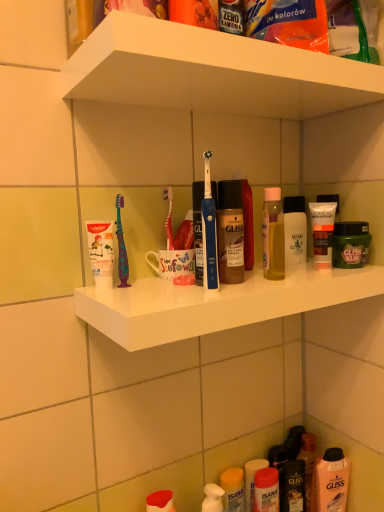
Question: Is white plastic shelf at upper center, which is the first supermarket shelf from top to bottom, shorter than white plastic shelf at upper center, the 1th supermarket shelf positioned from the bottom?

Choices:
 (A) yes
 (B) no

Answer: (A)

Question: Is white plastic shelf at upper center, acting as the 2th supermarket shelf starting from the bottom, positioned with its back to white plastic shelf at upper center, the 1th supermarket shelf positioned from the bottom?

Choices:
 (A) yes
 (B) no

Answer: (B)

Question: Are white plastic shelf at upper center, which is the first supermarket shelf from top to bottom, and white plastic shelf at upper center, positioned as the 2th supermarket shelf in top-to-bottom order, far apart?

Choices:
 (A) yes
 (B) no

Answer: (B)

Question: Can we say white plastic shelf at upper center, acting as the 2th supermarket shelf starting from the bottom, lies outside white plastic shelf at upper center, positioned as the 2th supermarket shelf in top-to-bottom order?

Choices:
 (A) no
 (B) yes

Answer: (B)

Question: Considering the relative sizes of white plastic shelf at upper center, acting as the 2th supermarket shelf starting from the bottom, and white plastic shelf at upper center, the 1th supermarket shelf positioned from the bottom, in the image provided, is white plastic shelf at upper center, acting as the 2th supermarket shelf starting from the bottom, bigger than white plastic shelf at upper center, the 1th supermarket shelf positioned from the bottom,?

Choices:
 (A) yes
 (B) no

Answer: (B)

Question: Is white plastic shelf at upper center, which is the first supermarket shelf from top to bottom, oriented towards white plastic shelf at upper center, the 1th supermarket shelf positioned from the bottom?

Choices:
 (A) yes
 (B) no

Answer: (B)

Question: From the image's perspective, is white matte tube at right, which ranks as the 2th toiletry in right-to-left order, beneath green matte hair mask at right, which is the third toiletry from bottom to top?

Choices:
 (A) no
 (B) yes

Answer: (A)

Question: Is white matte tube at right, which appears as the 1th toiletry when viewed from the top, outside green matte hair mask at right, the 2th toiletry positioned from the top?

Choices:
 (A) no
 (B) yes

Answer: (B)

Question: From the image's perspective, is white matte tube at right, the fourth toiletry in the bottom-to-top sequence, on green matte hair mask at right, which ranks as the fourth toiletry in left-to-right order?

Choices:
 (A) yes
 (B) no

Answer: (A)

Question: Is white matte tube at right, which appears as the 1th toiletry when viewed from the top, in front of green matte hair mask at right, which is the third toiletry from bottom to top?

Choices:
 (A) no
 (B) yes

Answer: (B)

Question: Can green matte hair mask at right, which ranks as the fourth toiletry in left-to-right order, be found inside white matte tube at right, the fourth toiletry in the bottom-to-top sequence?

Choices:
 (A) yes
 (B) no

Answer: (B)

Question: Does white matte tube at right, the fourth toiletry in the bottom-to-top sequence, have a larger size compared to green matte hair mask at right, which is the third toiletry from bottom to top?

Choices:
 (A) yes
 (B) no

Answer: (B)

Question: Does blue plastic toothbrush at center appear on the right side of green matte hair mask at right, which is the third toiletry from bottom to top?

Choices:
 (A) no
 (B) yes

Answer: (A)